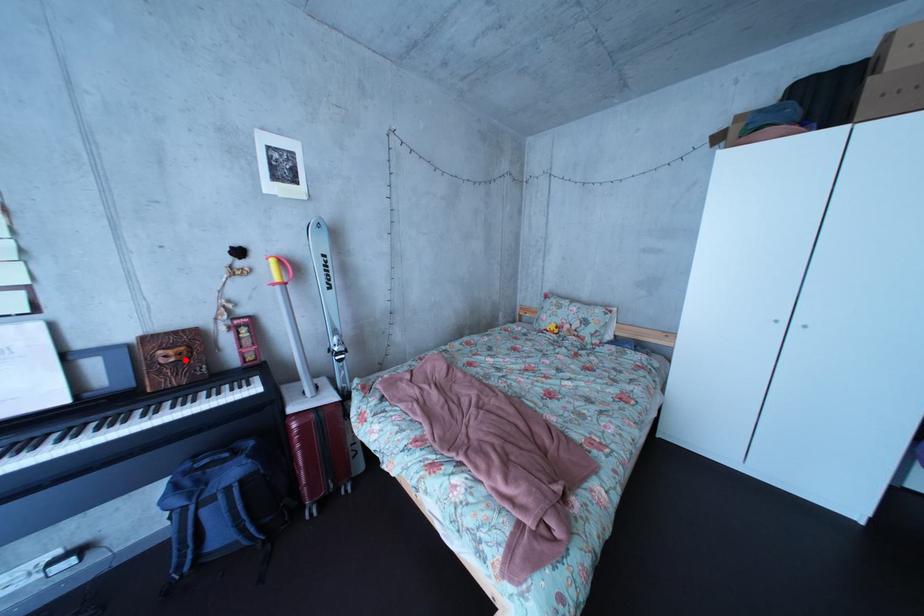
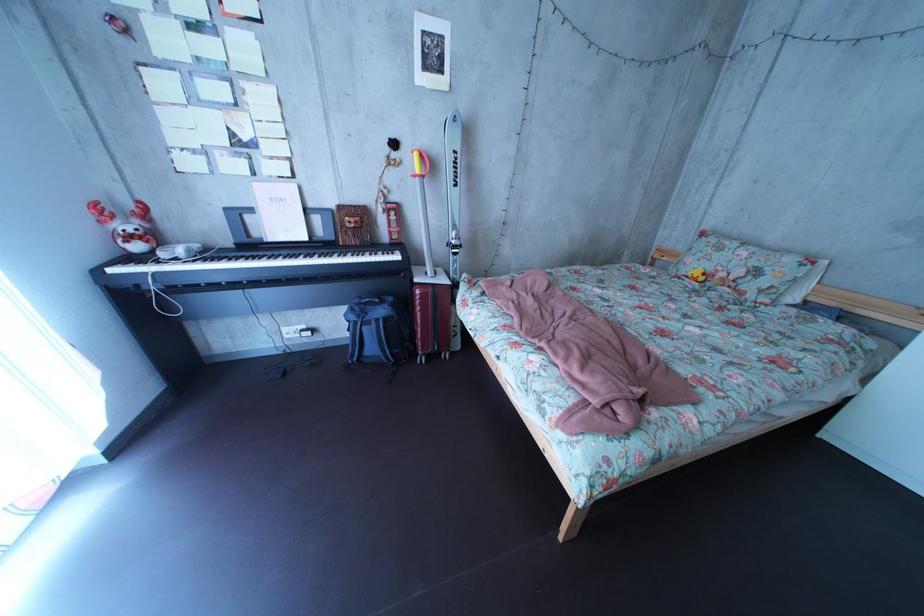
Question: I am providing you with two images of the same scene from different viewpoints. Given a red point in image1, look at the same physical point in image2. Is it:

Choices:
 (A) Closer to the viewpoint
 (B) Farther from the viewpoint

Answer: (A)